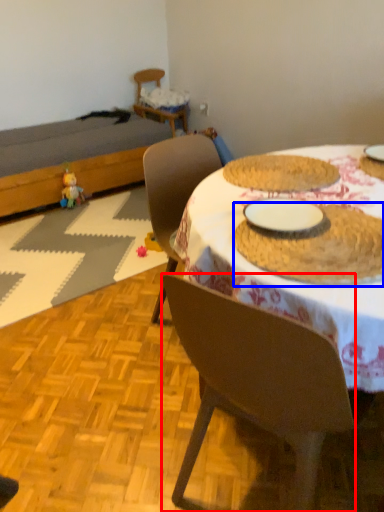
Question: Which point is further to the camera, chair (highlighted by a red box) or food (highlighted by a blue box)?

Choices:
 (A) chair
 (B) food

Answer: (B)